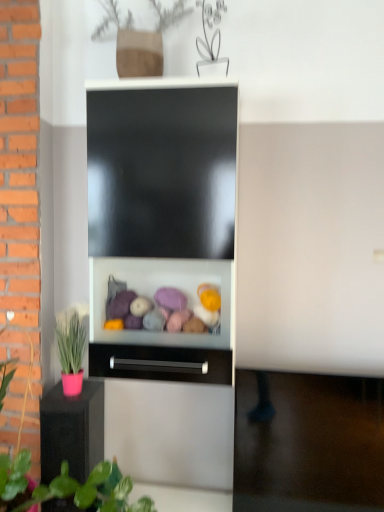
Question: Is pink matte pot at left facing towards black matte drawer at center?

Choices:
 (A) no
 (B) yes

Answer: (A)

Question: From a real-world perspective, is pink matte pot at left below black matte drawer at center?

Choices:
 (A) no
 (B) yes

Answer: (B)

Question: Does pink matte pot at left contain black matte drawer at center?

Choices:
 (A) yes
 (B) no

Answer: (A)

Question: Does pink matte pot at left have a smaller size compared to black matte drawer at center?

Choices:
 (A) yes
 (B) no

Answer: (B)

Question: Does pink matte pot at left have a greater width compared to black matte drawer at center?

Choices:
 (A) yes
 (B) no

Answer: (A)

Question: Considering the positions of point (140, 377) and point (89, 496), is point (140, 377) closer or farther from the camera than point (89, 496)?

Choices:
 (A) farther
 (B) closer

Answer: (A)

Question: From their relative heights in the image, would you say black matte drawer at center is taller or shorter than pink matte pot at left?

Choices:
 (A) short
 (B) tall

Answer: (A)

Question: Is black matte drawer at center wider or thinner than pink matte pot at left?

Choices:
 (A) wide
 (B) thin

Answer: (B)

Question: Is black matte drawer at center inside the boundaries of pink matte pot at left, or outside?

Choices:
 (A) inside
 (B) outside

Answer: (A)

Question: Considering the positions of pink matte pot at lower left and black matte drawer at center in the image, is pink matte pot at lower left taller or shorter than black matte drawer at center?

Choices:
 (A) tall
 (B) short

Answer: (A)

Question: Does point (87, 408) appear closer or farther from the camera than point (127, 357)?

Choices:
 (A) farther
 (B) closer

Answer: (A)

Question: In the image, is pink matte pot at lower left positioned in front of or behind black matte drawer at center?

Choices:
 (A) behind
 (B) front

Answer: (A)

Question: Based on their sizes in the image, would you say pink matte pot at lower left is bigger or smaller than black matte drawer at center?

Choices:
 (A) small
 (B) big

Answer: (B)

Question: Which is correct: pink matte pot at left is inside black matte drawer at center, or outside of it?

Choices:
 (A) inside
 (B) outside

Answer: (B)

Question: Is point (4, 458) positioned closer to the camera than point (119, 347)?

Choices:
 (A) farther
 (B) closer

Answer: (B)